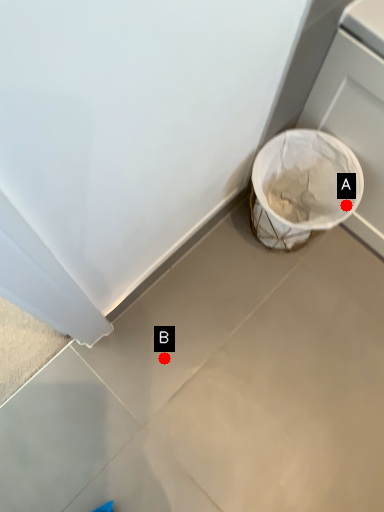
Question: Two points are circled on the image, labeled by A and B beside each circle. Among these points, which one is nearest to the camera?

Choices:
 (A) A is closer
 (B) B is closer

Answer: (A)